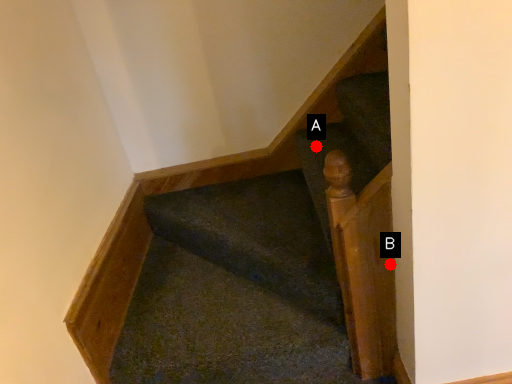
Question: Two points are circled on the image, labeled by A and B beside each circle. Which point is closer to the camera taking this photo?

Choices:
 (A) A is closer
 (B) B is closer

Answer: (B)